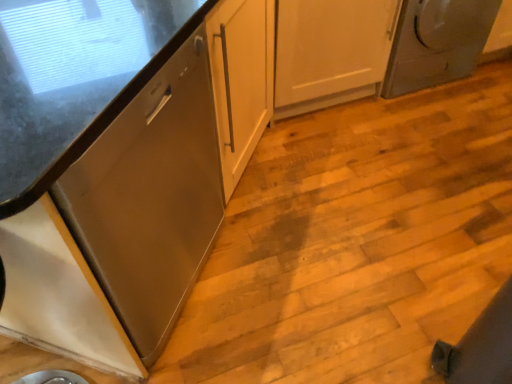
Question: Can you confirm if satin wood cabinet at left, the 1th cabinetry positioned from the top, is wider than white glossy cabinet at lower left, the first cabinetry in the bottom-to-top sequence?

Choices:
 (A) no
 (B) yes

Answer: (B)

Question: Are satin wood cabinet at left, the 1th cabinetry positioned from the top, and white glossy cabinet at lower left, the first cabinetry in the bottom-to-top sequence, far apart?

Choices:
 (A) yes
 (B) no

Answer: (B)

Question: Considering the relative sizes of satin wood cabinet at left, the 1th cabinetry positioned from the top, and white glossy cabinet at lower left, arranged as the second cabinetry when viewed from the top, in the image provided, is satin wood cabinet at left, the 1th cabinetry positioned from the top, smaller than white glossy cabinet at lower left, arranged as the second cabinetry when viewed from the top,?

Choices:
 (A) yes
 (B) no

Answer: (B)

Question: Does satin wood cabinet at left, the 1th cabinetry positioned from the top, have a lesser width compared to white glossy cabinet at lower left, arranged as the second cabinetry when viewed from the top?

Choices:
 (A) no
 (B) yes

Answer: (A)

Question: Does satin wood cabinet at left, positioned as the 2th cabinetry in bottom-to-top order, lie in front of white glossy cabinet at lower left, the first cabinetry in the bottom-to-top sequence?

Choices:
 (A) yes
 (B) no

Answer: (B)

Question: In terms of width, does white glossy cabinet at lower left, arranged as the second cabinetry when viewed from the top, look wider or thinner when compared to satin wood cabinet at left, the 1th cabinetry positioned from the top?

Choices:
 (A) thin
 (B) wide

Answer: (A)

Question: Considering the positions of white glossy cabinet at lower left, arranged as the second cabinetry when viewed from the top, and satin wood cabinet at left, positioned as the 2th cabinetry in bottom-to-top order, in the image, is white glossy cabinet at lower left, arranged as the second cabinetry when viewed from the top, bigger or smaller than satin wood cabinet at left, positioned as the 2th cabinetry in bottom-to-top order,?

Choices:
 (A) small
 (B) big

Answer: (A)

Question: From a real-world perspective, is white glossy cabinet at lower left, arranged as the second cabinetry when viewed from the top, positioned above or below satin wood cabinet at left, positioned as the 2th cabinetry in bottom-to-top order?

Choices:
 (A) above
 (B) below

Answer: (B)

Question: From the image's perspective, is white glossy cabinet at lower left, the first cabinetry in the bottom-to-top sequence, above or below satin wood cabinet at left, the 1th cabinetry positioned from the top?

Choices:
 (A) below
 (B) above

Answer: (A)

Question: In terms of width, does satin wood cabinet at left, positioned as the 2th cabinetry in bottom-to-top order, look wider or thinner when compared to satin silver dryer at upper right?

Choices:
 (A) thin
 (B) wide

Answer: (B)

Question: From a real-world perspective, relative to satin silver dryer at upper right, is satin wood cabinet at left, the 1th cabinetry positioned from the top, vertically above or below?

Choices:
 (A) below
 (B) above

Answer: (B)

Question: Choose the correct answer: Is satin wood cabinet at left, the 1th cabinetry positioned from the top, inside satin silver dryer at upper right or outside it?

Choices:
 (A) inside
 (B) outside

Answer: (B)

Question: Based on their positions, is satin wood cabinet at left, positioned as the 2th cabinetry in bottom-to-top order, located to the left or right of satin silver dryer at upper right?

Choices:
 (A) right
 (B) left

Answer: (B)

Question: Is satin wood cabinet at left, positioned as the 2th cabinetry in bottom-to-top order, wider or thinner than white glossy cabinet at lower left, arranged as the second cabinetry when viewed from the top?

Choices:
 (A) thin
 (B) wide

Answer: (B)

Question: Is satin wood cabinet at left, positioned as the 2th cabinetry in bottom-to-top order, situated inside white glossy cabinet at lower left, the first cabinetry in the bottom-to-top sequence, or outside?

Choices:
 (A) inside
 (B) outside

Answer: (B)